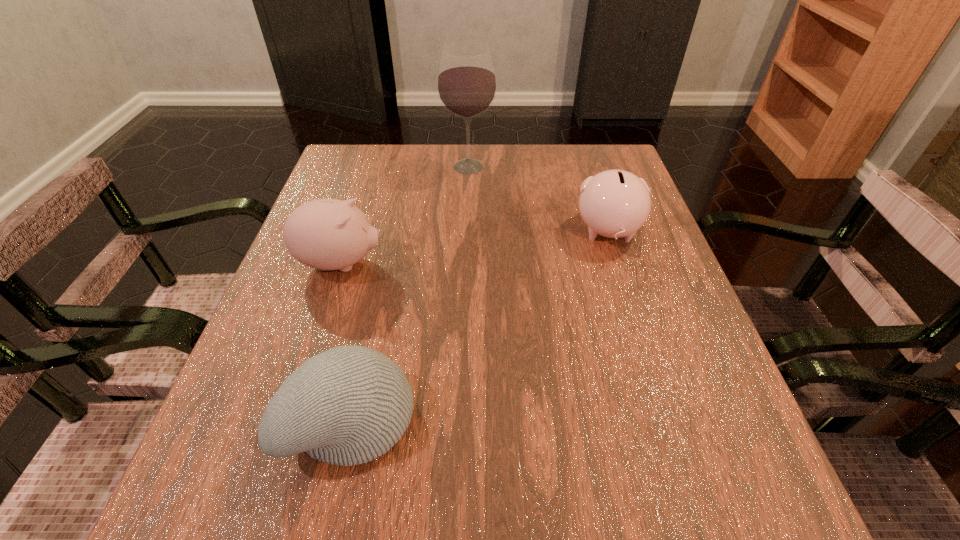
In the image, there is a desktop. Where is `vacant space at the near left corner`? vacant space at the near left corner is located at coordinates (300, 473).

Where is `vacant space at the near right corner of the desktop`? vacant space at the near right corner of the desktop is located at coordinates (767, 497).

You are a GUI agent. You are given a task and a screenshot of the screen. Output one action in this format:
    pyautogui.click(x=<x>, y=<y>)
    Task: Click on the vacant space in between the nearest object and the alcohol
    
    Given the screenshot: What is the action you would take?
    pyautogui.click(x=410, y=292)

What are the coordinates of `vacant area that lies between the farthest object and the right piggy bank` in the screenshot? It's located at (539, 200).

Identify the location of vacant area that lies between the beanie and the left piggy bank. (346, 340).

This screenshot has height=540, width=960. In order to click on vacant space that's between the left piggy bank and the nearest object in this screenshot , I will do `click(346, 340)`.

Where is `vacant space in between the right piggy bank and the left piggy bank`? This screenshot has width=960, height=540. vacant space in between the right piggy bank and the left piggy bank is located at coordinates (474, 248).

You are a GUI agent. You are given a task and a screenshot of the screen. Output one action in this format:
    pyautogui.click(x=<x>, y=<y>)
    Task: Click on the free space that is in between the left piggy bank and the right piggy bank
    
    Given the screenshot: What is the action you would take?
    pyautogui.click(x=474, y=248)

Locate an element on the screen. unoccupied position between the rightmost object and the left piggy bank is located at coordinates (474, 248).

This screenshot has height=540, width=960. Find the location of `vacant region between the left piggy bank and the nearest object`. vacant region between the left piggy bank and the nearest object is located at coordinates (346, 340).